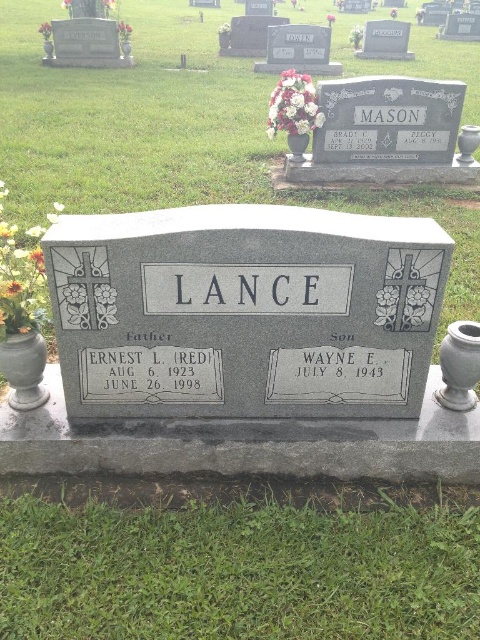
Question: Is black granite text at center thinner than white floral bouquet at center?

Choices:
 (A) no
 (B) yes

Answer: (B)

Question: Estimate the real-world distances between objects in this image. Which object is farther from the orange matte vase at center?

Choices:
 (A) white floral bouquet at center
 (B) matte yellow flower at left

Answer: (B)

Question: Which point is farther from the camera taking this photo?

Choices:
 (A) (16, 332)
 (B) (62, 3)
 (C) (228, 24)
 (D) (40, 33)

Answer: (B)

Question: Does black granite text at center appear on the right side of matte yellow flower at left?

Choices:
 (A) yes
 (B) no

Answer: (A)

Question: Which of the following is the closest to the observer?

Choices:
 (A) (176, 371)
 (B) (369, 372)
 (C) (69, 0)
 (D) (323, 116)

Answer: (A)

Question: Can you confirm if black stone text at center is positioned to the right of matte white vase at upper left?

Choices:
 (A) yes
 (B) no

Answer: (A)